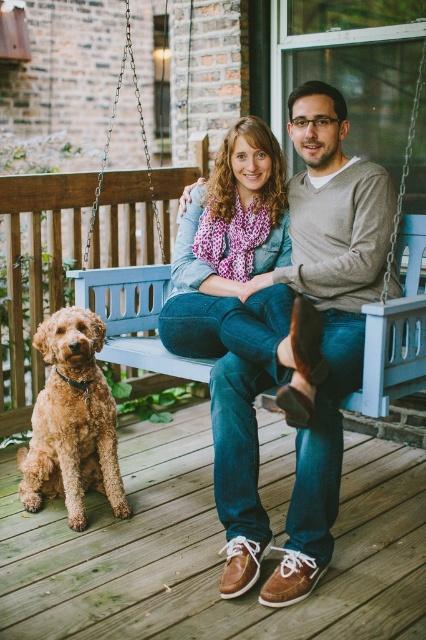
You are standing in front of the porch swing and want to place a small potted plant between the two points marked as point (x=49, y=472) and point (x=164, y=36). Which point should you place it closer to so that it appears larger in your view?

You should place the potted plant closer to point (x=49, y=472) because it is closer to the viewer than point (x=164, y=36), making objects placed there appear larger.

You are standing at the center of the image and want to locate the golden fur dog at lower left. According to its coordinates, in which direction should you move to find it?

The golden fur dog at lower left is located at coordinates point (71, 420). Since you are at the center, you should move downward and to the right to reach it.

You are a photographer standing in front of the blue wooden swing at center and the brown suede shoes at center. You want to take a photo that includes both objects but needs to ensure the smaller object is clearly visible. Which object should you focus on to ensure the smaller one is in focus?

The blue wooden swing at center is smaller than the brown suede shoes at center. To ensure the smaller object is in focus, you should focus on the blue wooden swing at center.